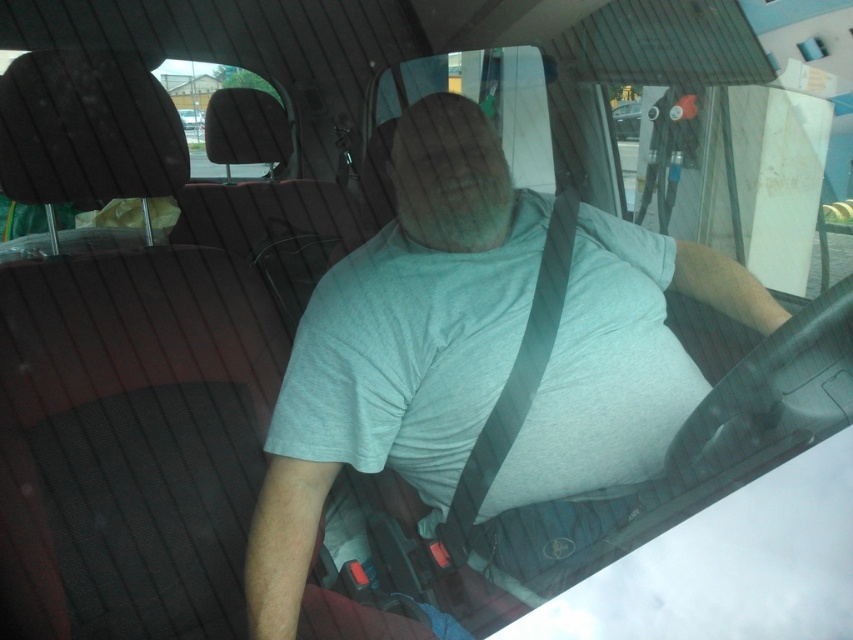
You are driving a car and need to check the fuel gauge located on the dashboard. While looking forward, you notice the transparent glass windshield at upper center and the gray fabric seatbelt at center. Which object is wider from your current viewpoint?

The transparent glass windshield at upper center is wider than the gray fabric seatbelt at center according to the description.

You are sitting in the driver seat of a car and want to reach a point marked at coordinates point (286,580). Can you comfortably reach it without leaving your seat?

The point (286,580) is 3.87 feet away from the viewer, so it is likely out of comfortable reach while sitting in the driver seat.

You are driving and want to check the weather outside. Which object would allow you to see the sky better, the transparent glass windshield at upper center or the metallic silver car at center?

The transparent glass windshield at upper center has a greater height compared to the metallic silver car at center, so it allows a better view of the sky.